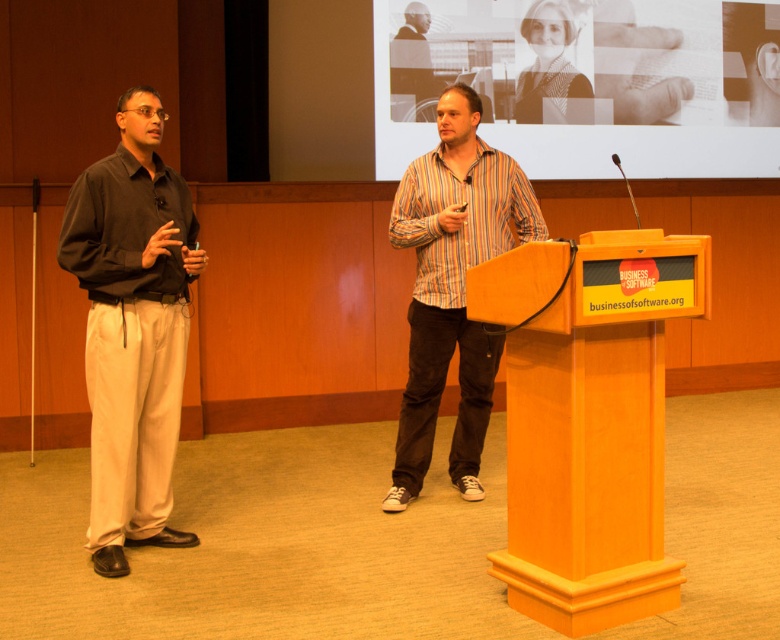
Is brown textured fabric at upper center further to camera compared to dark brown cotton shirt at left?

Yes, brown textured fabric at upper center is behind dark brown cotton shirt at left.

Can you confirm if brown textured fabric at upper center is smaller than dark brown cotton shirt at left?

No.

Locate an element on the screen. This screenshot has height=640, width=780. brown textured fabric at upper center is located at coordinates (587, 83).

Find the location of `brown textured fabric at upper center`. brown textured fabric at upper center is located at coordinates (587, 83).

Is point (646, 28) farther from viewer compared to point (527, 227)?

Yes, it is behind point (527, 227).

Identify the location of brown textured fabric at upper center. (587, 83).

Does wooden podium at center appear on the left side of striped cotton shirt at center?

In fact, wooden podium at center is to the right of striped cotton shirt at center.

Does wooden podium at center appear over striped cotton shirt at center?

No, wooden podium at center is not above striped cotton shirt at center.

Find the location of a particular element. The width and height of the screenshot is (780, 640). wooden podium at center is located at coordinates (587, 419).